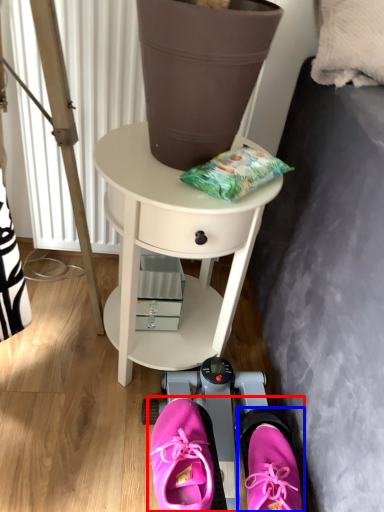
Question: Which object appears closest to the camera in this image, couple (highlighted by a red box) or footwear (highlighted by a blue box)?

Choices:
 (A) couple
 (B) footwear

Answer: (B)